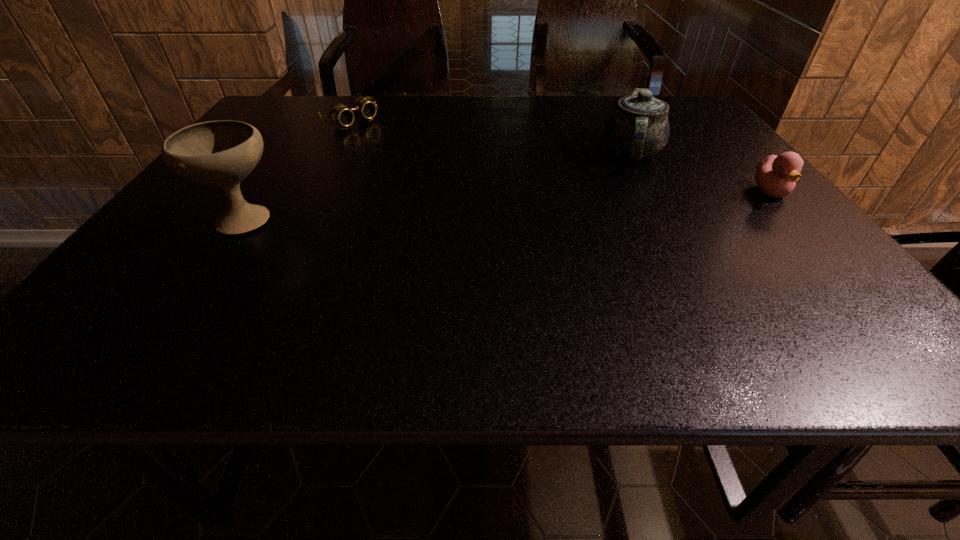
You are a GUI agent. You are given a task and a screenshot of the screen. Output one action in this format:
    pyautogui.click(x=<x>, y=<y>)
    Task: Click on the vacant space on the desktop that is between the chalice and the rightmost object and is positioned through the lenses of the goggles
    The width and height of the screenshot is (960, 540).
    Given the screenshot: What is the action you would take?
    pyautogui.click(x=495, y=205)

Identify the location of vacant spot on the desktop that is between the chalice and the third tallest object and is positioned from the spout of the second tallest object. (587, 201).